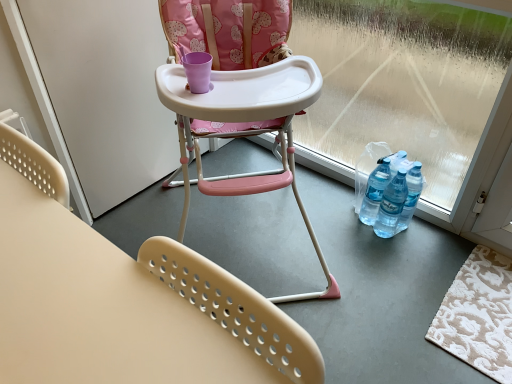
Question: Does transparent plastic window screen at lower right have a smaller size compared to white matte screen door at left?

Choices:
 (A) yes
 (B) no

Answer: (B)

Question: Considering the relative sizes of transparent plastic window screen at lower right and white matte screen door at left in the image provided, is transparent plastic window screen at lower right taller than white matte screen door at left?

Choices:
 (A) no
 (B) yes

Answer: (B)

Question: Is transparent plastic window screen at lower right outside of white matte screen door at left?

Choices:
 (A) no
 (B) yes

Answer: (B)

Question: Does transparent plastic window screen at lower right have a greater width compared to white matte screen door at left?

Choices:
 (A) no
 (B) yes

Answer: (B)

Question: Is white matte screen door at left surrounded by transparent plastic window screen at lower right?

Choices:
 (A) yes
 (B) no

Answer: (B)

Question: Would you say beige plastic chair at lower center, which is counted as the first chair, starting from the front, is inside or outside pink plastic highchair at center, the 1th chair from the back?

Choices:
 (A) outside
 (B) inside

Answer: (A)

Question: Is beige plastic chair at lower center, which is the 2th chair in back-to-front order, bigger or smaller than pink plastic highchair at center, the 2th chair when ordered from front to back?

Choices:
 (A) small
 (B) big

Answer: (A)

Question: From the image's perspective, is beige plastic chair at lower center, which is the 2th chair in back-to-front order, above or below pink plastic highchair at center, the 1th chair from the back?

Choices:
 (A) below
 (B) above

Answer: (A)

Question: Visually, is beige plastic chair at lower center, which is counted as the first chair, starting from the front, positioned to the left or to the right of pink plastic highchair at center, the 1th chair from the back?

Choices:
 (A) right
 (B) left

Answer: (B)

Question: From the image's perspective, is beige textured rug at lower right above or below white matte screen door at left?

Choices:
 (A) below
 (B) above

Answer: (A)

Question: Considering the positions of beige textured rug at lower right and white matte screen door at left in the image, is beige textured rug at lower right taller or shorter than white matte screen door at left?

Choices:
 (A) tall
 (B) short

Answer: (B)

Question: From a real-world perspective, is beige textured rug at lower right physically located above or below white matte screen door at left?

Choices:
 (A) above
 (B) below

Answer: (B)

Question: Considering the positions of point (456, 347) and point (126, 130), is point (456, 347) closer or farther from the camera than point (126, 130)?

Choices:
 (A) closer
 (B) farther

Answer: (A)

Question: Is white matte screen door at left taller or shorter than transparent plastic window screen at lower right?

Choices:
 (A) short
 (B) tall

Answer: (A)

Question: Considering the positions of white matte screen door at left and transparent plastic window screen at lower right in the image, is white matte screen door at left wider or thinner than transparent plastic window screen at lower right?

Choices:
 (A) thin
 (B) wide

Answer: (A)